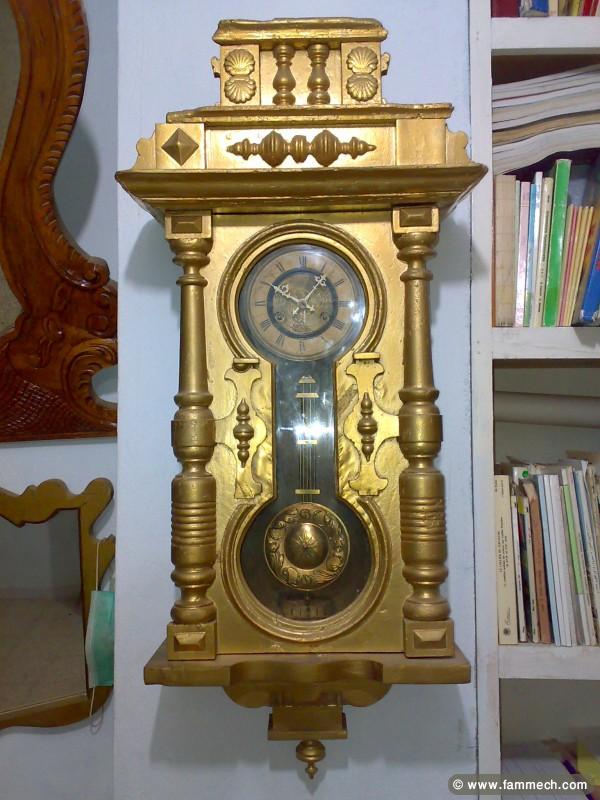
Where is `clock`? clock is located at coordinates (298, 302).